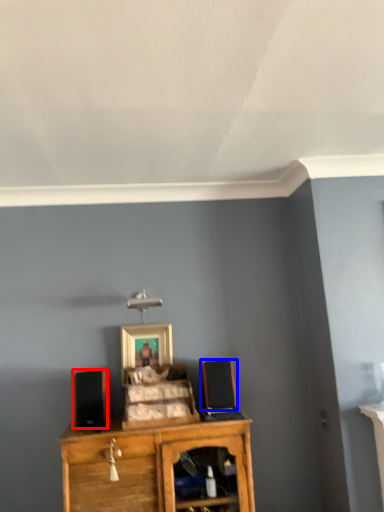
Question: Which object appears farthest to the camera in this image, speaker (highlighted by a red box) or speaker (highlighted by a blue box)?

Choices:
 (A) speaker
 (B) speaker

Answer: (B)